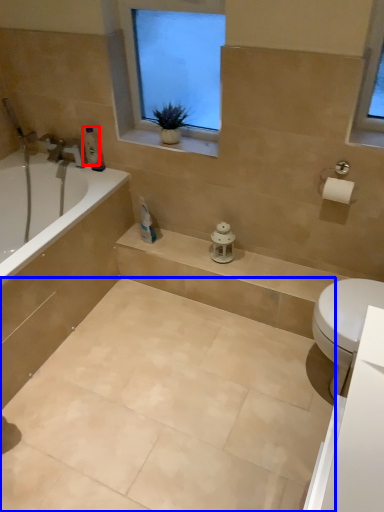
Question: Which object is further to the camera taking this photo, toiletry (highlighted by a red box) or ceramic tile (highlighted by a blue box)?

Choices:
 (A) toiletry
 (B) ceramic tile

Answer: (A)